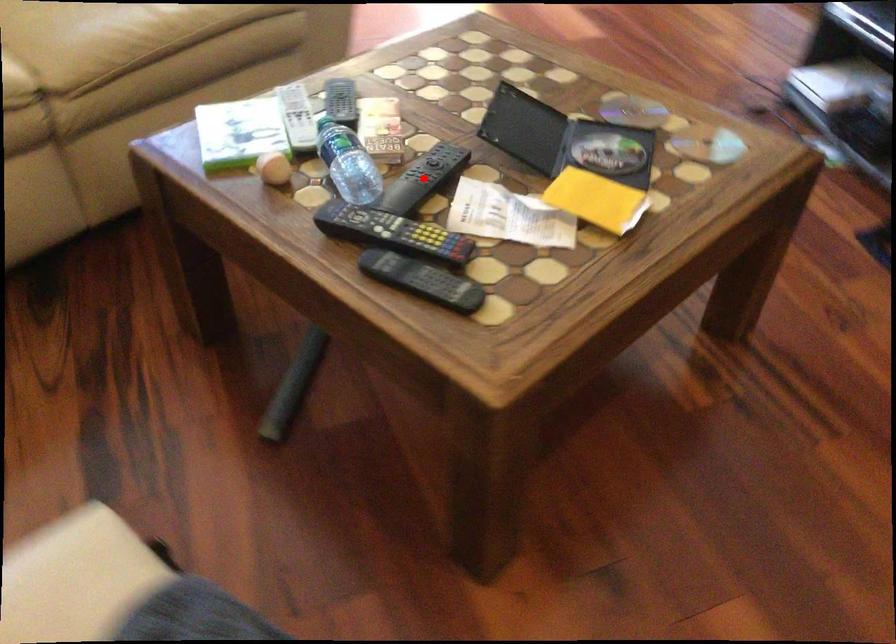
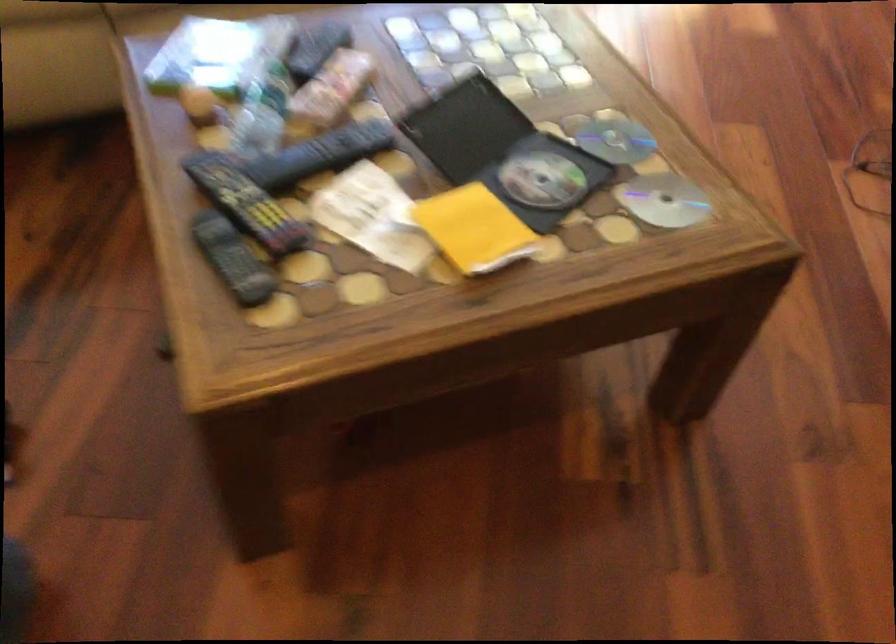
Where in the second image is the point corresponding to the highlighted location from the first image?

(320, 154)